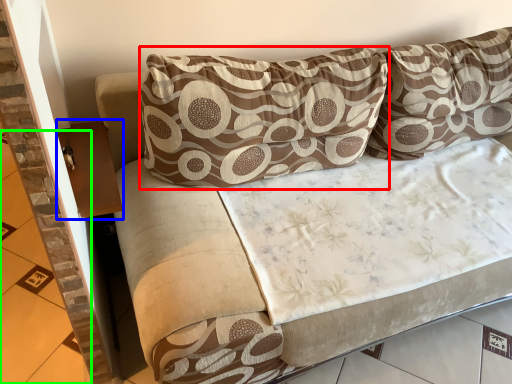
Question: Which object is the farthest from pillow (highlighted by a red box)? Choose among these: table (highlighted by a blue box) or tile (highlighted by a green box).

Choices:
 (A) table
 (B) tile

Answer: (B)